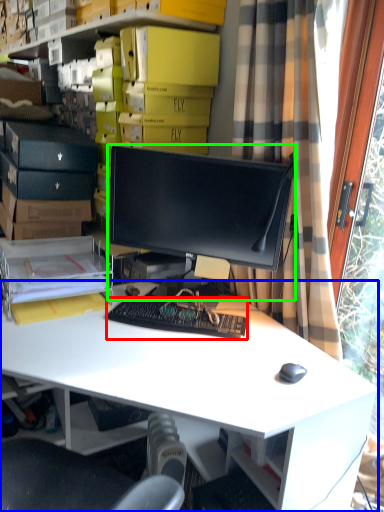
Question: Based on their relative distances, which object is nearer to computer keyboard (highlighted by a red box)? Choose from desk (highlighted by a blue box) and computer monitor (highlighted by a green box).

Choices:
 (A) desk
 (B) computer monitor

Answer: (A)